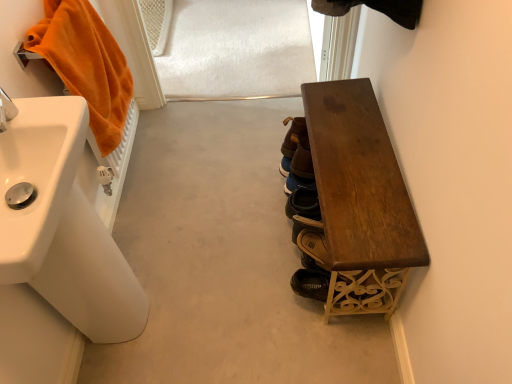
The image size is (512, 384). I want to click on vacant area that lies between dark wood bench at right and white glossy sink at left, acting as the 2th sink starting from the front, so click(228, 261).